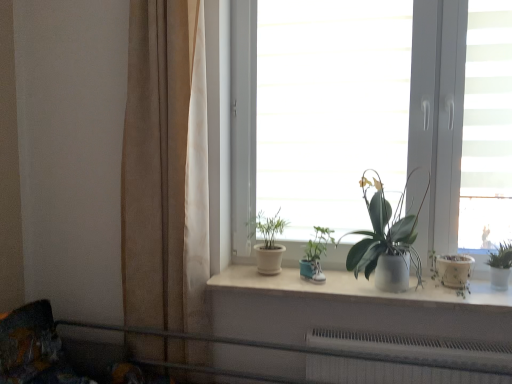
Question: Is teal fabric shoe at center, which is the 2th houseplant from left to right, spatially inside metallic gray rail at lower center, or outside of it?

Choices:
 (A) inside
 (B) outside

Answer: (B)

Question: Considering their positions, is teal fabric shoe at center, which is the 2th houseplant from left to right, located in front of or behind metallic gray rail at lower center?

Choices:
 (A) front
 (B) behind

Answer: (B)

Question: Which is farther from the white matte window at center?

Choices:
 (A) white matte window sill at center
 (B) green matte plant at center, acting as the 3th houseplant starting from the left
 (C) metallic gray rail at lower center
 (D) matte white pot at center, marked as the fourth houseplant in a right-to-left arrangement
 (E) teal fabric shoe at center, which is the 2th houseplant from left to right

Answer: (C)

Question: Which object is the closest to the green matte plant at center, the 2th houseplant viewed from the right?

Choices:
 (A) metallic gray rail at lower center
 (B) white matte window sill at center
 (C) burlap curtain at left
 (D) white matte window at center
 (E) teal fabric shoe at center, which is the 3th houseplant in right-to-left order

Answer: (B)